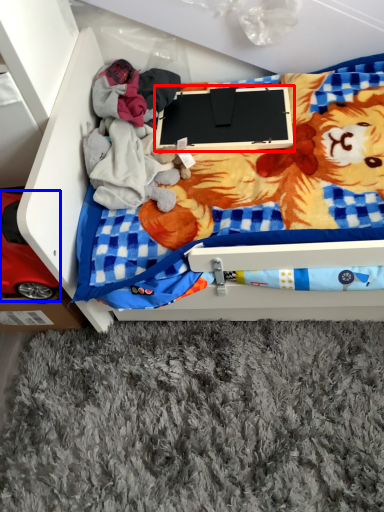
Question: Which object is further to the camera taking this photo, laptop (highlighted by a red box) or toy (highlighted by a blue box)?

Choices:
 (A) laptop
 (B) toy

Answer: (A)